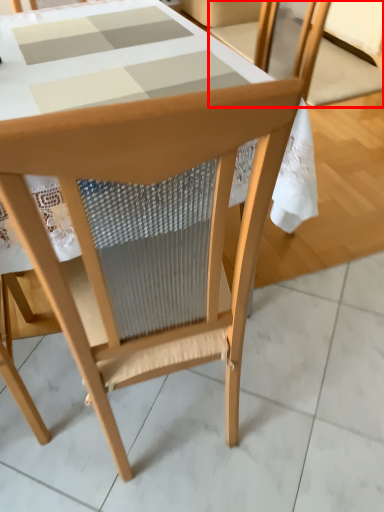
Question: From the image, what is the correct spatial relationship of chair (annotated by the red box) in relation to chair?

Choices:
 (A) right
 (B) left

Answer: (A)